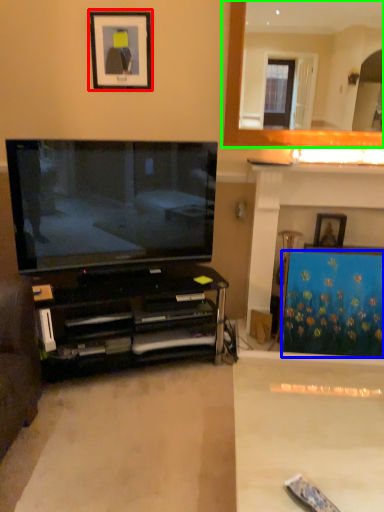
Question: Which object is the farthest from picture frame (highlighted by a red box)? Choose among these: curtain (highlighted by a blue box) or fireplace (highlighted by a green box).

Choices:
 (A) curtain
 (B) fireplace

Answer: (A)